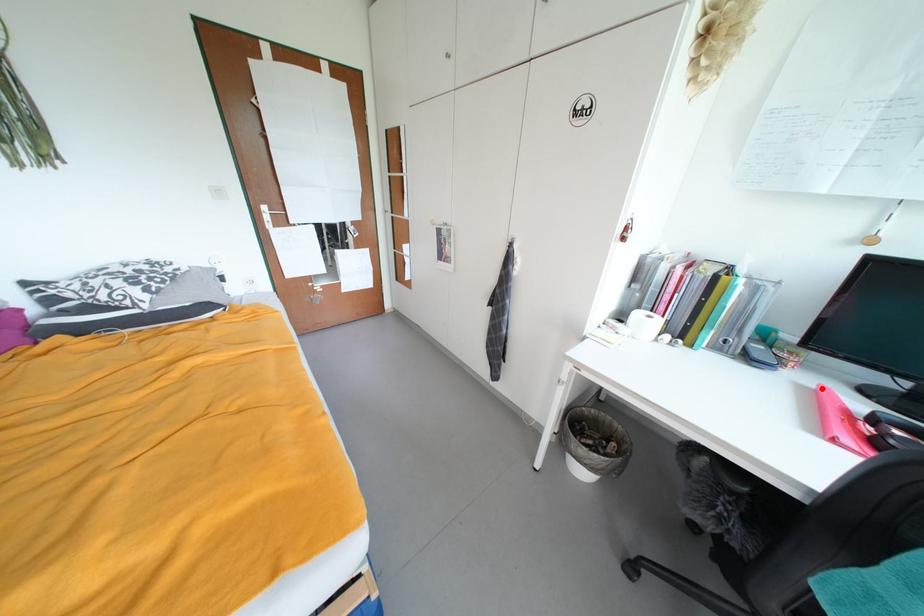
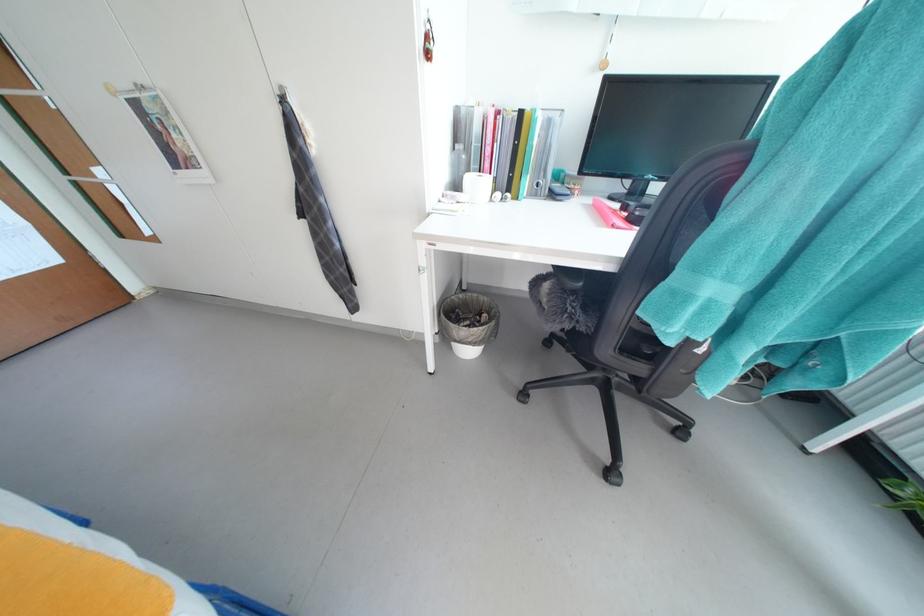
Find the pixel in the second image that matches the highlighted location in the first image.

(599, 204)